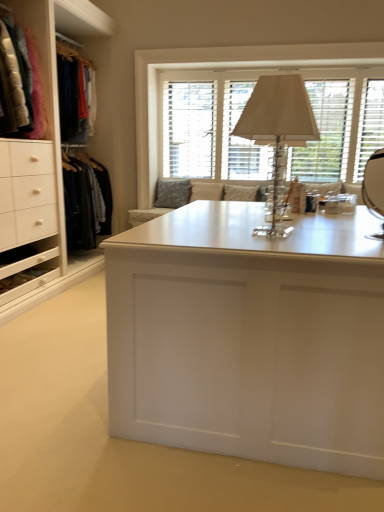
Question: From the image's perspective, is textured gray pillow at center above velvet jackets at left?

Choices:
 (A) yes
 (B) no

Answer: (B)

Question: Is textured gray pillow at center at the left side of velvet jackets at left?

Choices:
 (A) yes
 (B) no

Answer: (B)

Question: From the image's perspective, is textured gray pillow at center beneath velvet jackets at left?

Choices:
 (A) no
 (B) yes

Answer: (B)

Question: From a real-world perspective, is textured gray pillow at center over velvet jackets at left?

Choices:
 (A) no
 (B) yes

Answer: (A)

Question: Considering the relative positions of textured gray pillow at center and velvet jackets at left in the image provided, is textured gray pillow at center in front of velvet jackets at left?

Choices:
 (A) no
 (B) yes

Answer: (A)

Question: Considering the relative sizes of textured gray pillow at center and velvet jackets at left in the image provided, is textured gray pillow at center bigger than velvet jackets at left?

Choices:
 (A) no
 (B) yes

Answer: (A)

Question: Is white wood window at upper center not inside velvet jackets at left?

Choices:
 (A) no
 (B) yes

Answer: (B)

Question: Are white wood window at upper center and velvet jackets at left beside each other?

Choices:
 (A) no
 (B) yes

Answer: (A)

Question: Does white wood window at upper center have a greater height compared to velvet jackets at left?

Choices:
 (A) no
 (B) yes

Answer: (B)

Question: From a real-world perspective, is white wood window at upper center located beneath velvet jackets at left?

Choices:
 (A) no
 (B) yes

Answer: (B)

Question: Does white wood window at upper center have a lesser width compared to velvet jackets at left?

Choices:
 (A) no
 (B) yes

Answer: (B)

Question: Does white wood window at upper center appear on the right side of velvet jackets at left?

Choices:
 (A) no
 (B) yes

Answer: (B)

Question: Does velvet jackets at left come behind clear crystal table lamp at center?

Choices:
 (A) no
 (B) yes

Answer: (B)